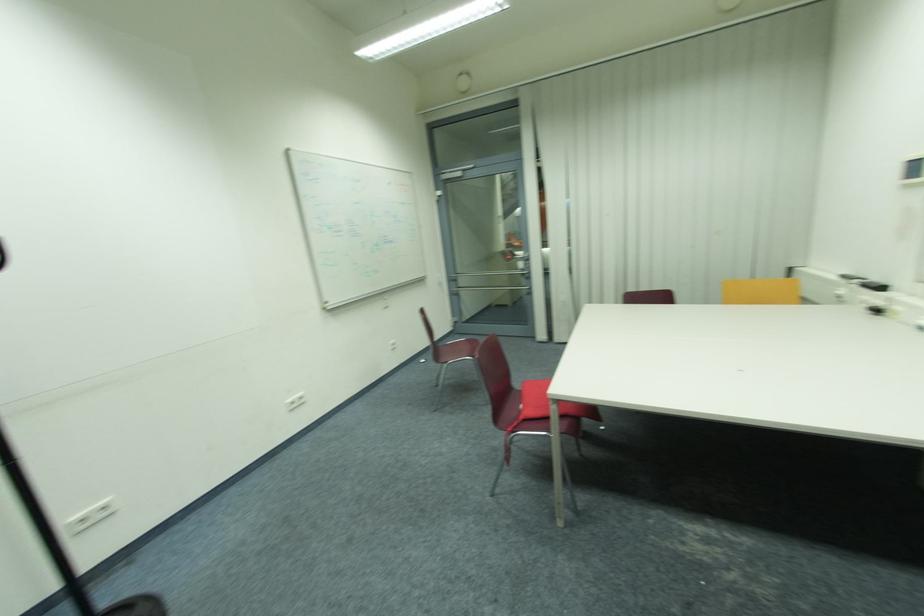
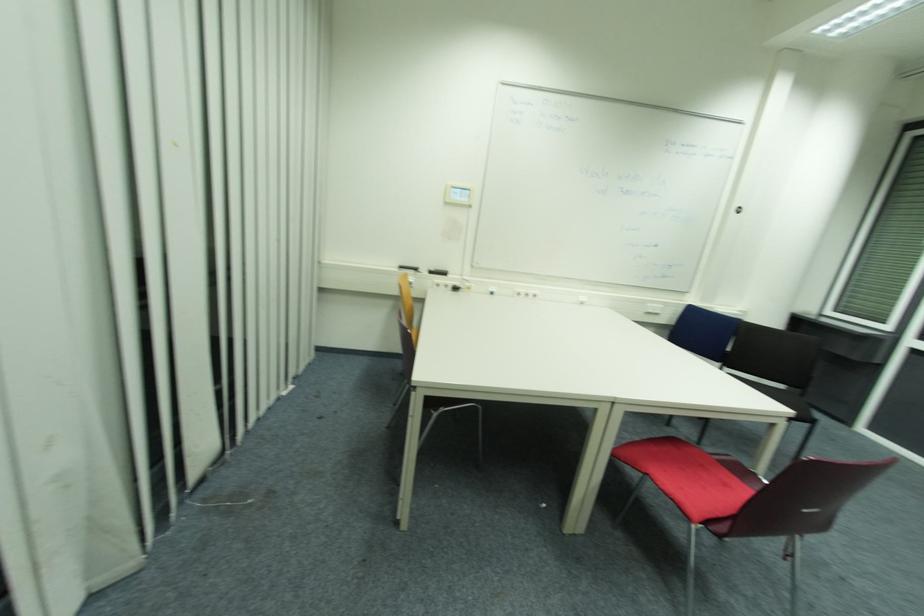
Where in the second image is the point corresponding to point (882, 313) from the first image?

(458, 290)